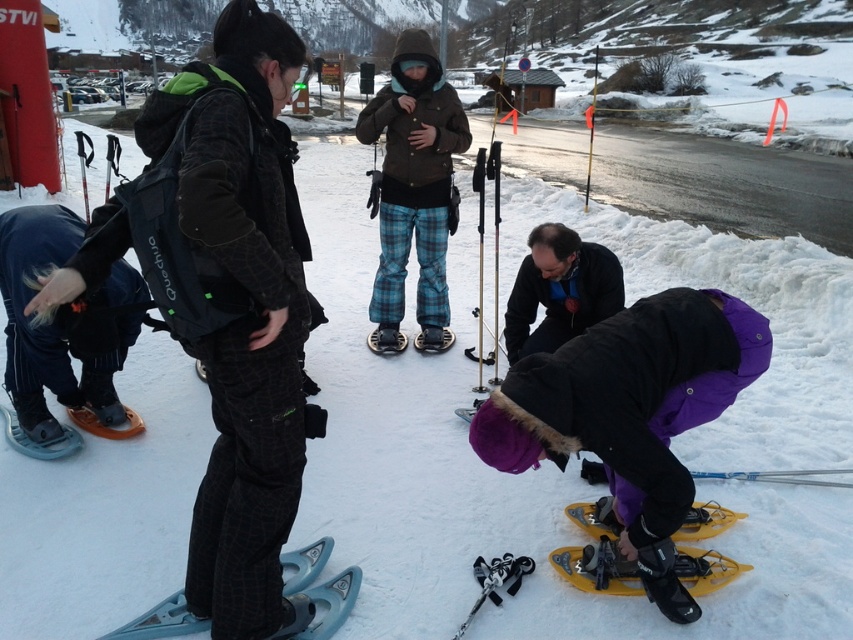
Does purple fleece jacket at lower right come behind matte black snowshoe at lower left?

That is False.

The height and width of the screenshot is (640, 853). Identify the location of purple fleece jacket at lower right. (631, 412).

How much distance is there between purple fleece jacket at lower right and black matte snowshoes at lower left?

purple fleece jacket at lower right is 1.80 meters away from black matte snowshoes at lower left.

Based on the photo, which is above, purple fleece jacket at lower right or black matte snowshoes at lower left?

Positioned higher is black matte snowshoes at lower left.

Does point (630, 520) come farther from viewer compared to point (32, 272)?

No, (630, 520) is closer to viewer.

This screenshot has height=640, width=853. I want to click on purple fleece jacket at lower right, so (631, 412).

Can you confirm if brown plaid pants at center is wider than matte black snowshoe at center?

Correct, the width of brown plaid pants at center exceeds that of matte black snowshoe at center.

Where is `brown plaid pants at center`? The height and width of the screenshot is (640, 853). brown plaid pants at center is located at coordinates (415, 182).

Does point (416, 307) come in front of point (445, 332)?

That is True.

Locate an element on the screen. The image size is (853, 640). brown plaid pants at center is located at coordinates (415, 182).